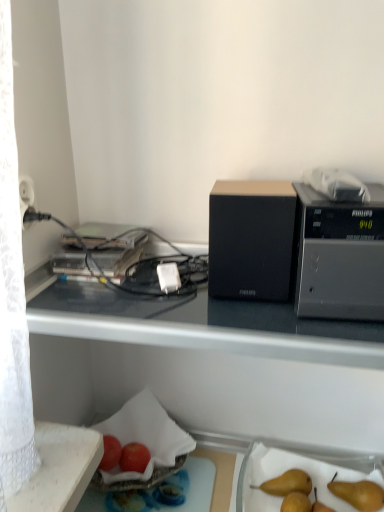
At what (x,y) coordinates should I click in order to perform the action: click on free space to the left of white plastic power plug at center. Please return your answer as a coordinate pair (x, y). The image size is (384, 512). Looking at the image, I should click on (91, 289).